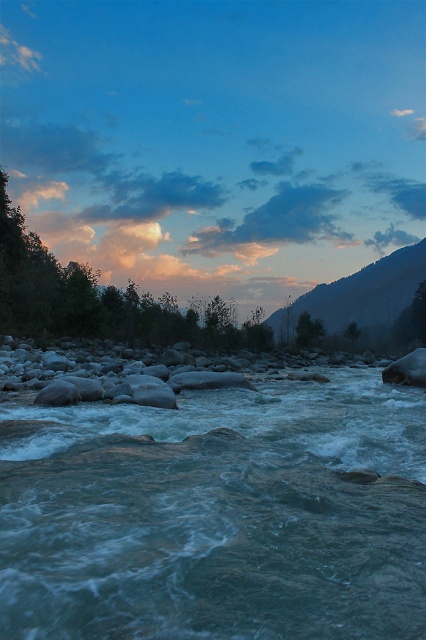
Consider the image. You are a hiker planning to cross the river using a narrow wooden bridge. The bridge can only support a path that is as wide as the translucent blue water at center. Is the width of the bridge sufficient to span across the rocky mountain at upper right?

The translucent blue water at center has a lesser width compared to rocky mountain at upper right. Since the bridge can only support the width of the water, it would not be wide enough to span the rocky mountain at upper right, which is wider.

You are standing at the edge of the river and need to cross to the other side. The translucent blue water at center is the deepest part of the river. Where should you step to avoid the deepest part?

The translucent blue water at center is located at point [218,515], so you should avoid stepping there and instead look for shallower areas away from the center to cross safely.

Consider the image. You are a hiker who wants to cross the river. You see the translucent blue water at center and the rocky mountain at upper right. Which object is taller, and would you consider the water level a challenge for crossing?

The rocky mountain at upper right is taller than the translucent blue water at center. The water level might be challenging for crossing due to its height, but since the mountain is taller, the water depth could vary. However, the description only mentions height comparison, not depth. Proceed with caution considering the rapids mentioned in the scene.